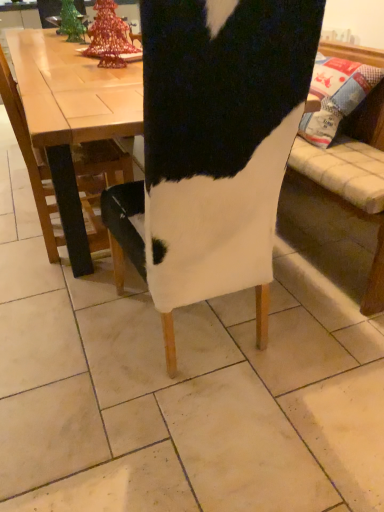
Find the location of `vacant area situated below white fabric chair at center, the 1th chair positioned from the right (from a real-world perspective)`. vacant area situated below white fabric chair at center, the 1th chair positioned from the right (from a real-world perspective) is located at coordinates (204, 350).